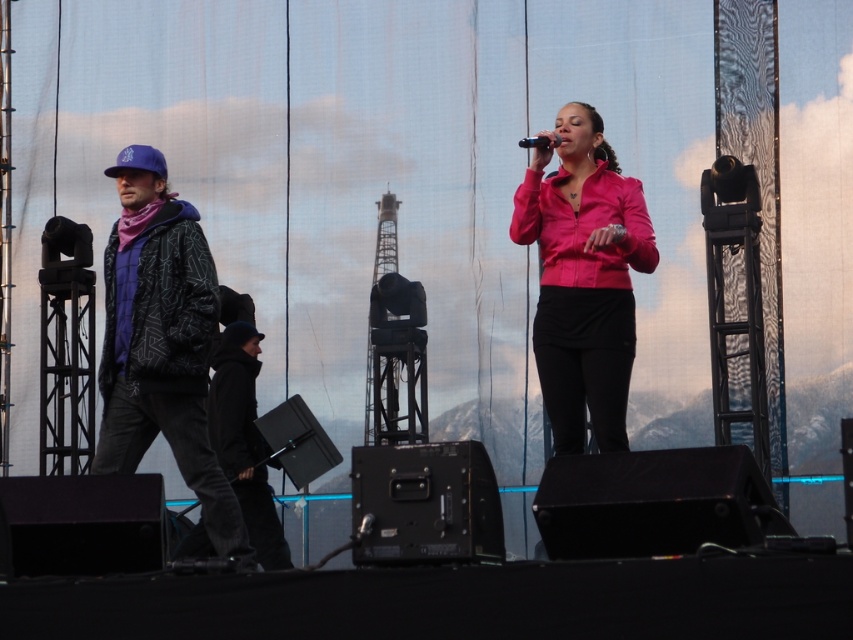
Question: Does matte black jacket at left have a greater width compared to pink matte jacket at center?

Choices:
 (A) yes
 (B) no

Answer: (A)

Question: Which object is farther from the camera taking this photo?

Choices:
 (A) black matte microphone at center
 (B) pink matte jacket at center

Answer: (B)

Question: Can you confirm if matte black jacket at left is smaller than black matte microphone at center?

Choices:
 (A) no
 (B) yes

Answer: (A)

Question: Which of the following is the farthest from the observer?

Choices:
 (A) (555, 301)
 (B) (158, 365)

Answer: (A)

Question: Which point is closer to the camera?

Choices:
 (A) black matte microphone at center
 (B) matte black jacket at left
 (C) pink matte jacket at center

Answer: (B)

Question: From the image, what is the correct spatial relationship of pink matte jacket at center in relation to black matte microphone at center?

Choices:
 (A) right
 (B) left

Answer: (A)